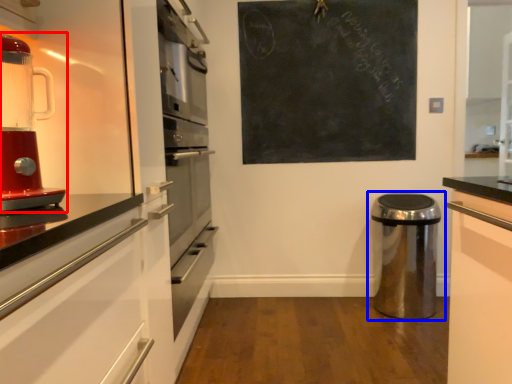
Question: Which object appears closest to the camera in this image, home appliance (highlighted by a red box) or waste container (highlighted by a blue box)?

Choices:
 (A) home appliance
 (B) waste container

Answer: (A)